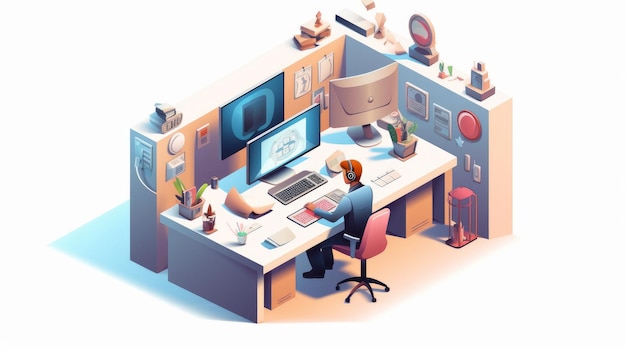
Locate an element on the screen. picture is located at coordinates (419, 101), (442, 117), (330, 69), (305, 77), (322, 96), (202, 142).